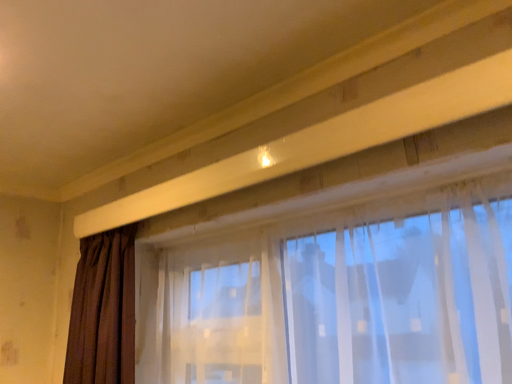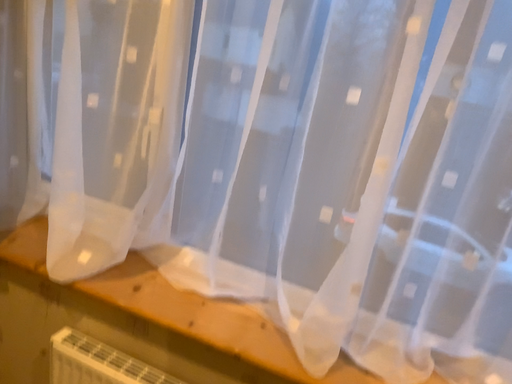
Question: How did the camera likely rotate when shooting the video?

Choices:
 (A) rotated right
 (B) rotated left

Answer: (A)